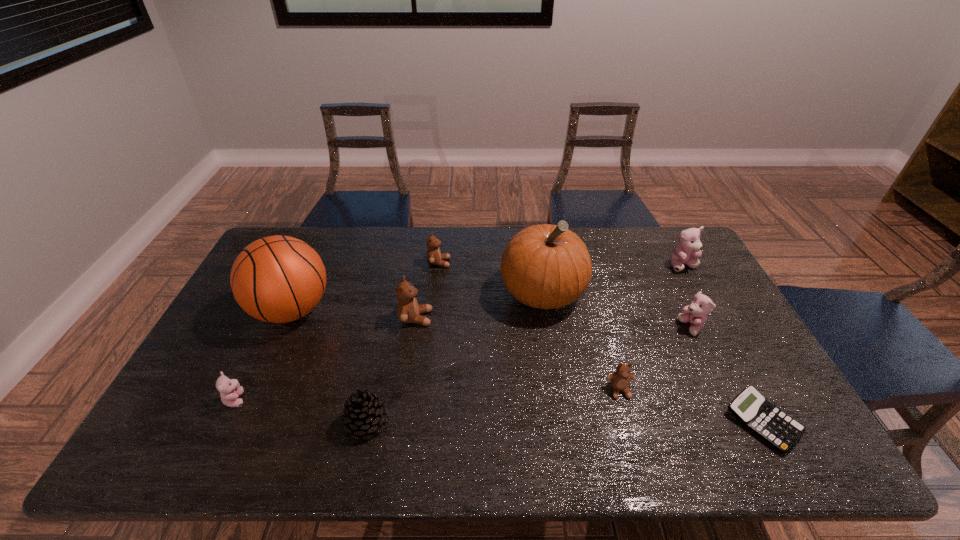
At what (x,y) coordinates should I click in order to perform the action: click on orange pumpkin. Please return your answer as a coordinate pair (x, y). This screenshot has width=960, height=540. Looking at the image, I should click on (545, 266).

What are the coordinates of `basketball` in the screenshot? It's located at (277, 279).

At what (x,y) coordinates should I click in order to perform the action: click on the farthest pink teddy bear. Please return your answer as a coordinate pair (x, y). This screenshot has width=960, height=540. Looking at the image, I should click on (689, 246).

You are a GUI agent. You are given a task and a screenshot of the screen. Output one action in this format:
    pyautogui.click(x=<x>, y=<y>)
    Task: Click on the biggest brown teddy bear
    
    Given the screenshot: What is the action you would take?
    pyautogui.click(x=408, y=311)

This screenshot has width=960, height=540. Find the location of `the second smallest brown teddy bear`. the second smallest brown teddy bear is located at coordinates (434, 257).

Find the location of a particular element. The height and width of the screenshot is (540, 960). the second smallest pink teddy bear is located at coordinates (696, 313).

Identify the location of pinecone. Image resolution: width=960 pixels, height=540 pixels. (364, 412).

In order to click on the fourth teddy bear from left to right in this screenshot , I will do `click(620, 380)`.

You are a GUI agent. You are given a task and a screenshot of the screen. Output one action in this format:
    pyautogui.click(x=<x>, y=<y>)
    Task: Click on the smallest brown teddy bear
    This screenshot has height=540, width=960.
    Given the screenshot: What is the action you would take?
    tap(620, 380)

Locate an element on the screen. The width and height of the screenshot is (960, 540). the smallest pink teddy bear is located at coordinates (230, 389).